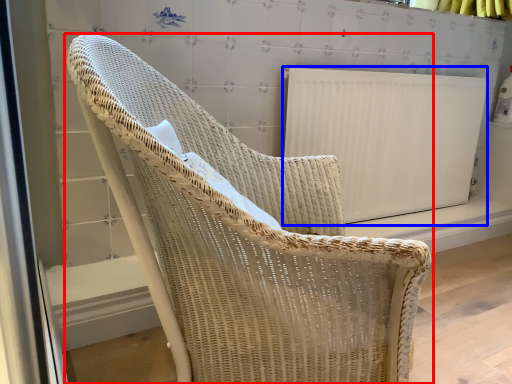
Question: Which object is further to the camera taking this photo, chair (highlighted by a red box) or radiator (highlighted by a blue box)?

Choices:
 (A) chair
 (B) radiator

Answer: (B)